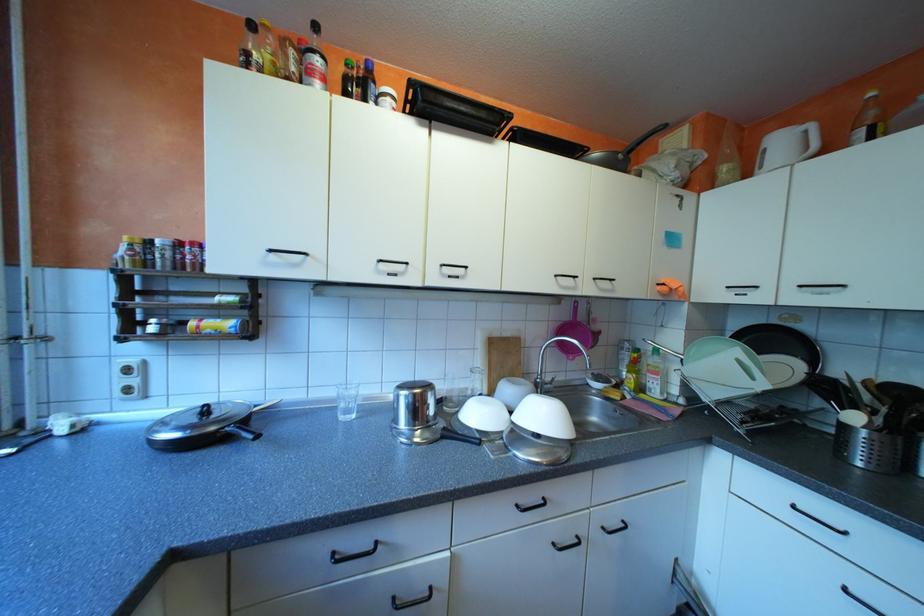
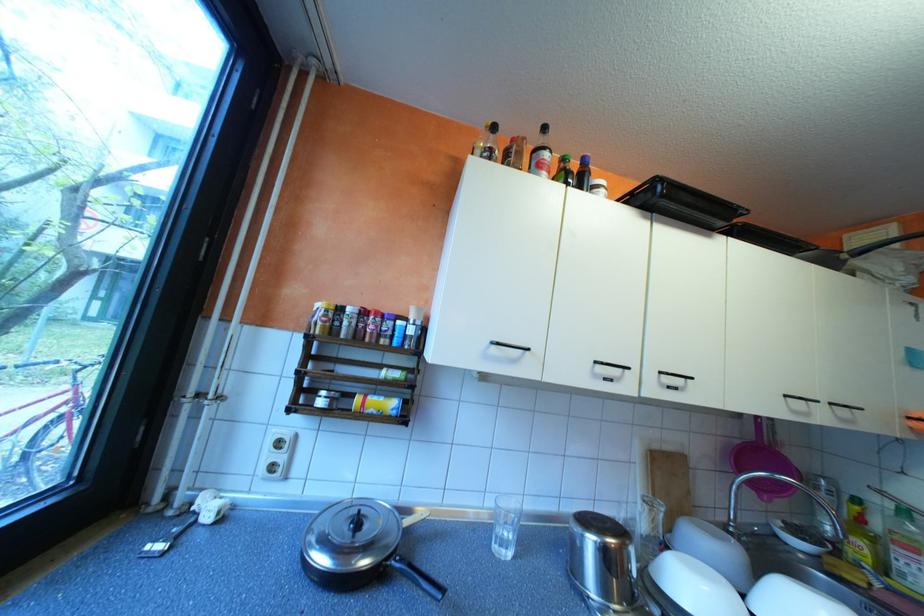
In the second image, find the point that corresponds to pixel 641 375 in the first image.

(871, 541)